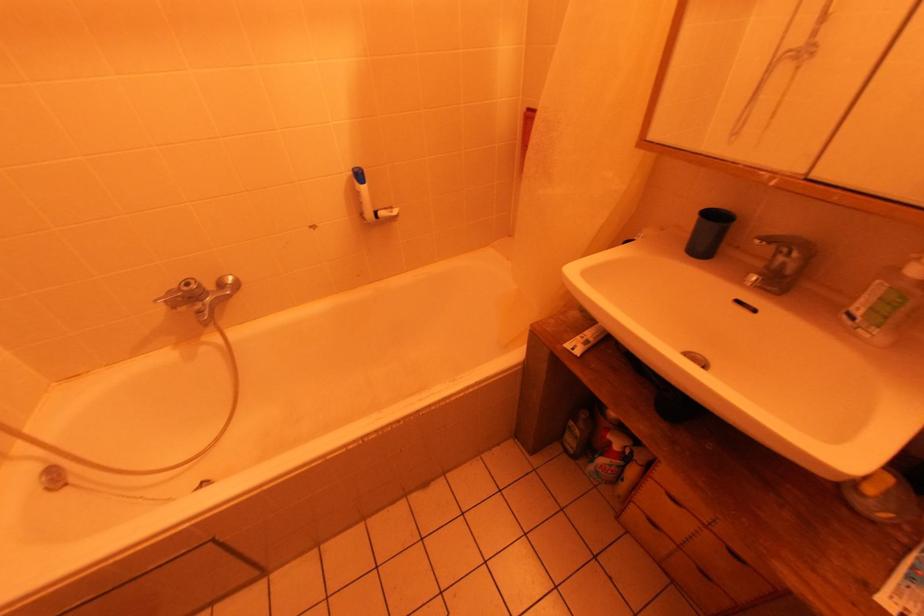
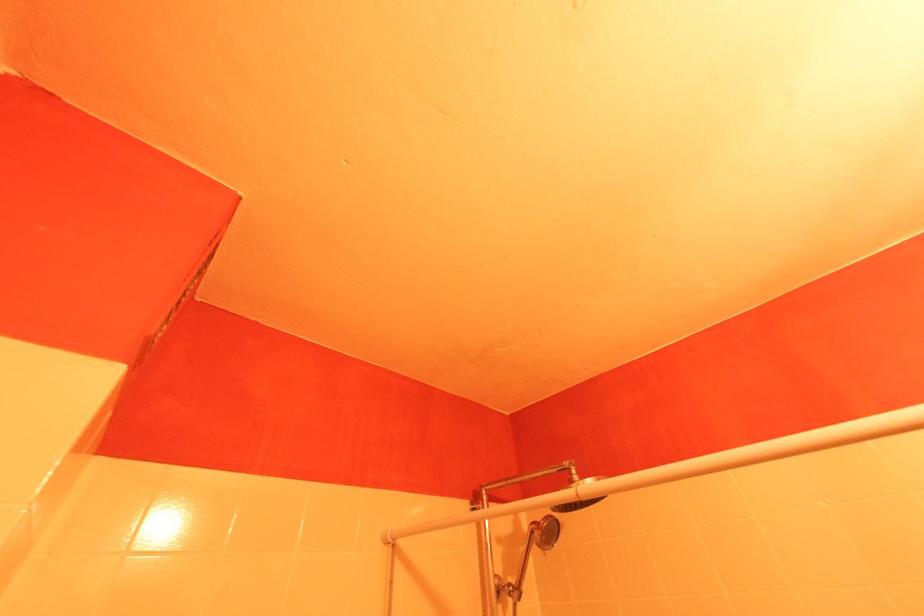
How did the camera likely rotate?

The camera's rotation is toward left-up.